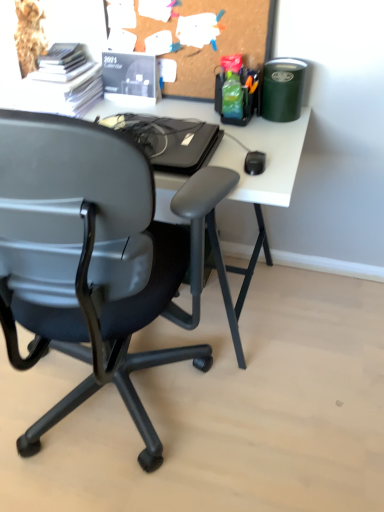
Where is `free space in front of matte black calendar at upper center, which ranks as the 3th stationery in right-to-left order`? This screenshot has width=384, height=512. free space in front of matte black calendar at upper center, which ranks as the 3th stationery in right-to-left order is located at coordinates (144, 109).